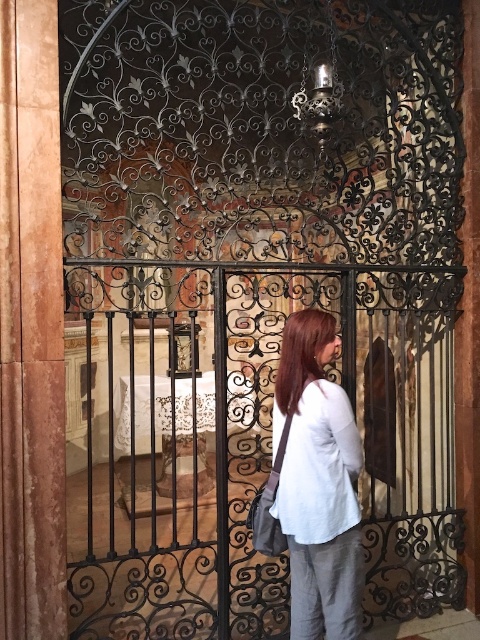
You are a security guard in the building and need to check the size of the objects in the image. Which object is bigger between the brown wood pillar at left and the white linen shirt at center?

The brown wood pillar at left is larger in size than the white linen shirt at center.

You are standing in front of the gate and need to locate the light gray cotton shirt at center. According to the coordinates provided, where exactly should you look to find it?

The light gray cotton shirt at center is located at coordinates point (x=317, y=483), so you should look towards the lower right area of the gate.

You are standing at the entrance of the historical building and see two points marked in the scene. The first point is at coordinates point (59, 305) and the second is at point (322, 529). Which of these points is closer to you?

Point (59, 305) is closer to you because it is further to the camera than point (322, 529).